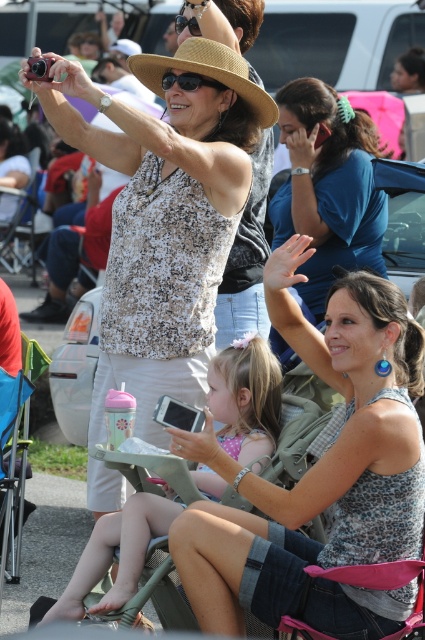
Between speckled tank top at center and matte blue shirt at center, which one appears on the left side from the viewer's perspective?

Positioned to the left is speckled tank top at center.

Who is more distant from viewer, (x=255, y=552) or (x=323, y=257)?

The point (x=323, y=257) is behind.

Between point (354, 305) and point (280, 218), which one is positioned behind?

Positioned behind is point (280, 218).

Identify the location of speckled tank top at center. (314, 461).

Is the position of matte blue shirt at center more distant than that of matte pink phone at center?

Yes, it is.

Does matte blue shirt at center have a greater width compared to matte pink phone at center?

In fact, matte blue shirt at center might be narrower than matte pink phone at center.

Describe the element at coordinates (328, 186) in the screenshot. I see `matte blue shirt at center` at that location.

At what (x,y) coordinates should I click in order to perform the action: click on matte blue shirt at center. Please return your answer as a coordinate pair (x, y). Looking at the image, I should click on (328, 186).

Who is lower down, speckled tank top at center or matte pink phone at center?

Positioned lower is matte pink phone at center.

Does speckled tank top at center lie behind matte pink phone at center?

That is False.

Is point (399, 593) positioned before point (255, 429)?

Yes, point (399, 593) is in front of point (255, 429).

Find the location of a particular element. The image size is (425, 640). speckled tank top at center is located at coordinates (314, 461).